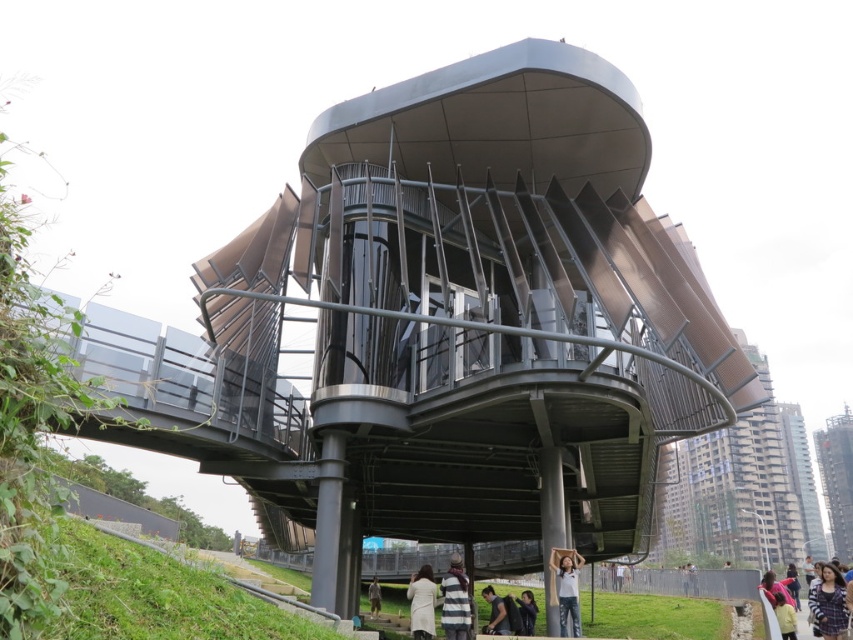
You are standing on the observation deck and notice two items at lower center. Which item is smaller? The striped wool scarf at lower center or the dark brown hair at lower center?

The striped wool scarf at lower center is smaller than the dark brown hair at lower center.

You are standing on an observation deck and want to ensure safety. You have a striped wool scarf at lower center and dark brown hair at lower center. What is the minimum safe distance you should maintain between these two items to comply with safety regulations?

The minimum safe distance between the striped wool scarf at lower center and dark brown hair at lower center is 6.37 meters, so you should maintain at least that distance to comply with safety regulations.

You are an architect designing a new outdoor space. You have a plaid shirt at lower right and a metallic brown balcony at right in your design. Which object has a greater width according to the scene?

The metallic brown balcony at right has a greater width than the plaid shirt at lower right.